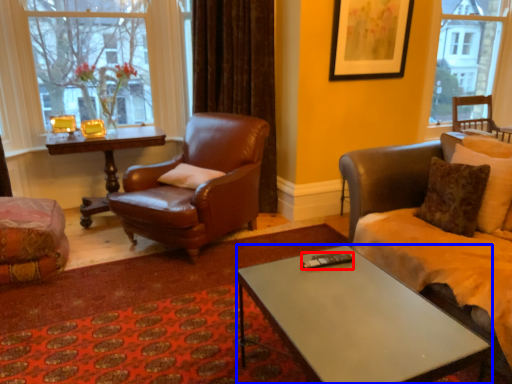
Question: Which object appears closest to the camera in this image, remote control (highlighted by a red box) or coffee table (highlighted by a blue box)?

Choices:
 (A) remote control
 (B) coffee table

Answer: (B)